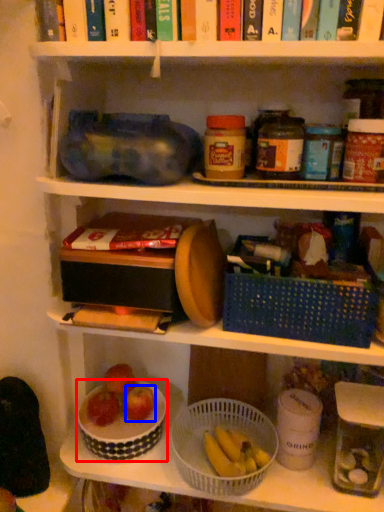
Question: Among these objects, which one is farthest to the camera, bowl (highlighted by a red box) or apple (highlighted by a blue box)?

Choices:
 (A) bowl
 (B) apple

Answer: (B)